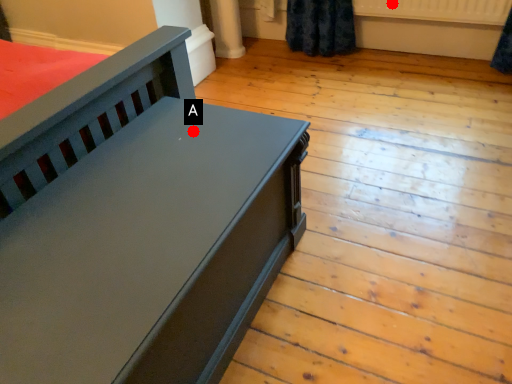
Question: Two points are circled on the image, labeled by A and B beside each circle. Among these points, which one is nearest to the camera?

Choices:
 (A) A is closer
 (B) B is closer

Answer: (A)